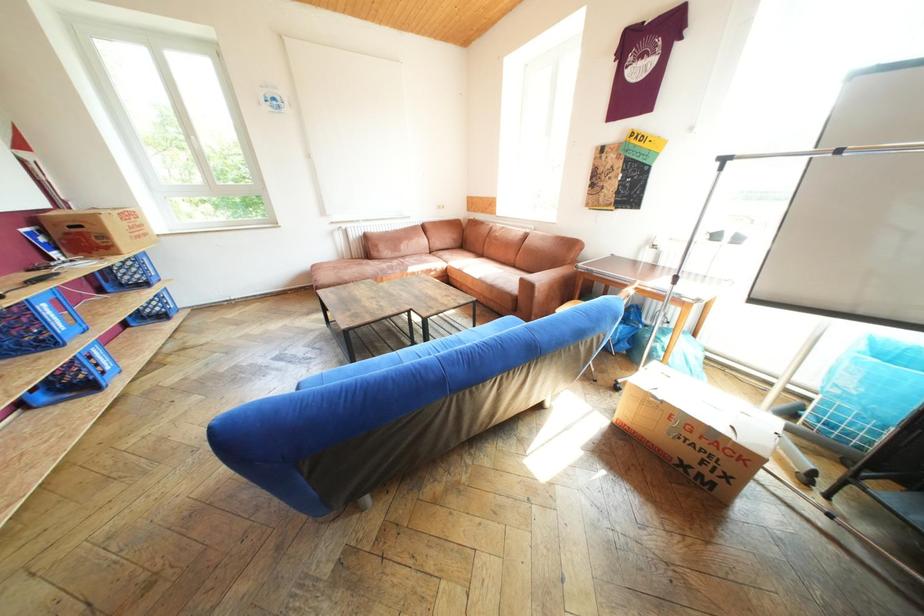
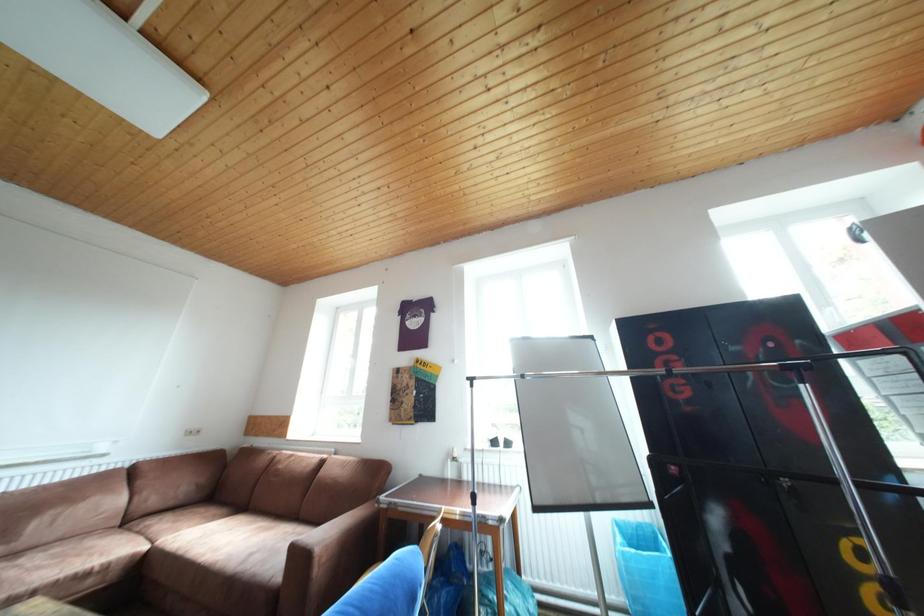
The images are taken continuously from a first-person perspective. In which direction is your viewpoint rotating?

The camera's rotation is toward right-up.